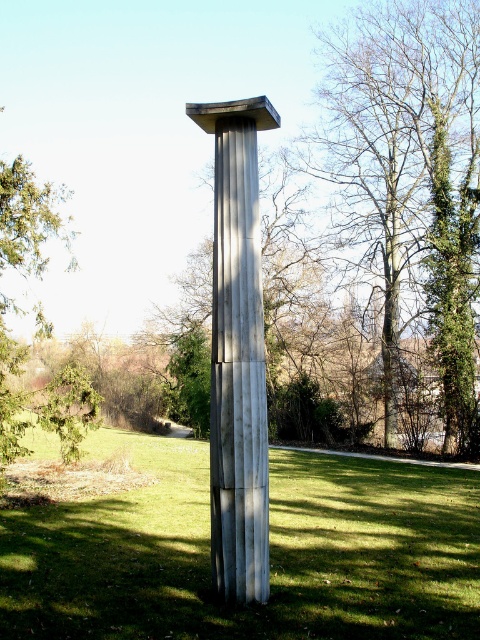
You are standing in the park and see the sculpture. There is green grass at center and a green leafy tree at center. From your position, which one is located to the left?

The green grass at center is located to the left of the green leafy tree at center.

You are standing in the park and see the green grass at center and the satin silver column at center. Which object is closer to you?

The green grass at center is closer to you because it is in front of the satin silver column at center.